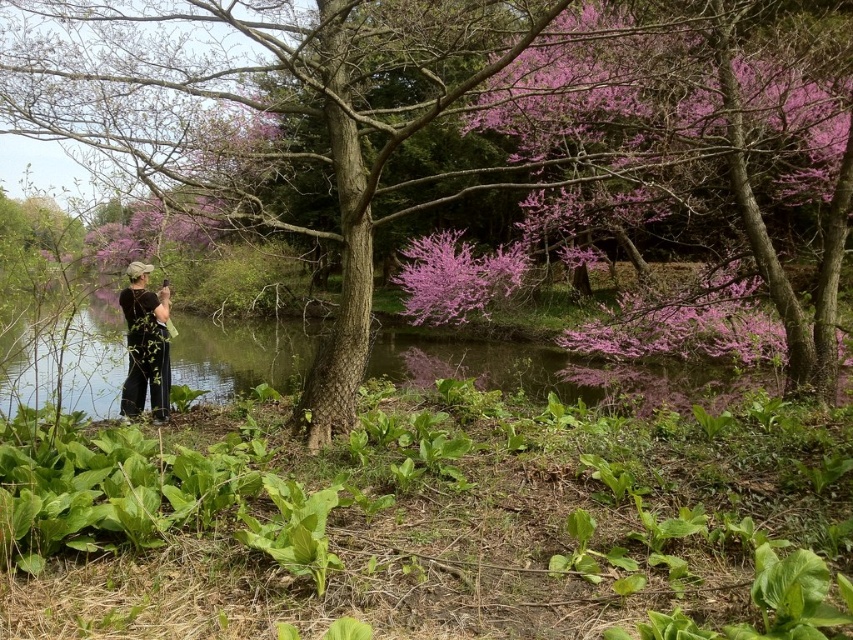
Question: Is green leafy water at center positioned before pink bloom at center?

Choices:
 (A) no
 (B) yes

Answer: (B)

Question: Which point is closer to the camera?

Choices:
 (A) (105, 340)
 (B) (457, 282)
 (C) (167, 403)

Answer: (A)

Question: Can you confirm if pink bloom at center is positioned above black cotton shirt at center?

Choices:
 (A) no
 (B) yes

Answer: (B)

Question: Which object is the closest to the smooth bark tree at center?

Choices:
 (A) black cotton shirt at center
 (B) pink bloom at center
 (C) green leafy water at center

Answer: (C)

Question: Can you confirm if smooth bark tree at center is bigger than green leafy water at center?

Choices:
 (A) no
 (B) yes

Answer: (B)

Question: Which object is closer to the camera taking this photo?

Choices:
 (A) pink bloom at center
 (B) green leafy water at center

Answer: (B)